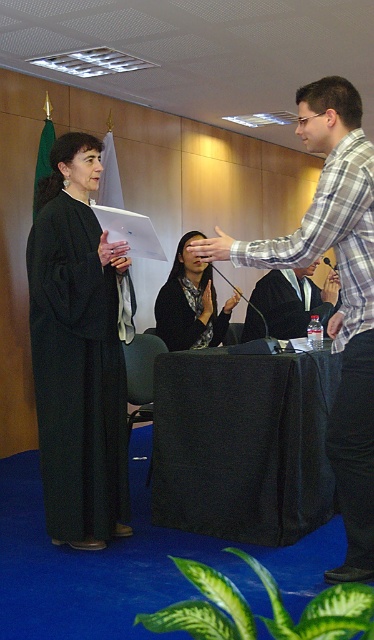
Question: Which point is closer to the camera?

Choices:
 (A) (372, 552)
 (B) (167, 312)
 (C) (72, 525)

Answer: (A)

Question: In this image, where is black fabric table at center located relative to black matte robe at left?

Choices:
 (A) right
 (B) left

Answer: (A)

Question: Does matte black jacket at center appear over black matte robe at center?

Choices:
 (A) no
 (B) yes

Answer: (B)

Question: Which of these objects is positioned closest to the black matte robe at left?

Choices:
 (A) matte black jacket at center
 (B) black fabric table at center
 (C) black robe at center
 (D) black matte robe at center

Answer: (B)

Question: Observing the image, what is the correct spatial positioning of black robe at center in reference to matte black jacket at center?

Choices:
 (A) above
 (B) below

Answer: (B)

Question: Which point is closer to the camera?

Choices:
 (A) black matte robe at left
 (B) black matte robe at center
 (C) black robe at center

Answer: (C)